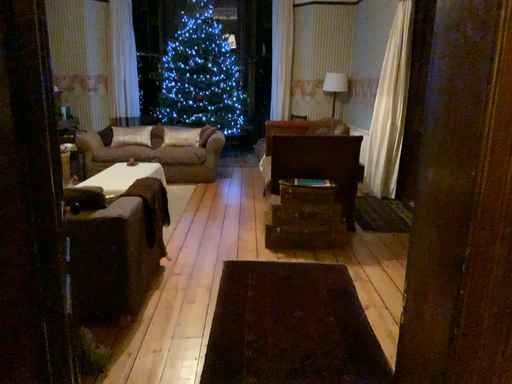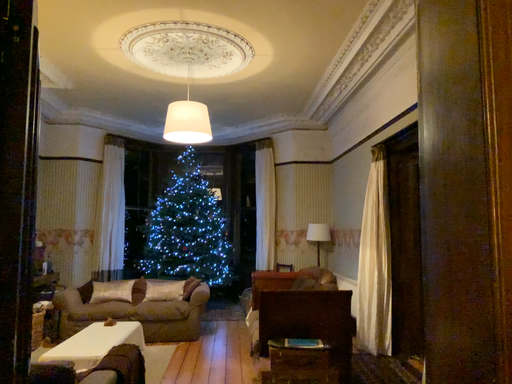
Question: Which way did the camera rotate in the video?

Choices:
 (A) rotated downward
 (B) rotated upward

Answer: (B)